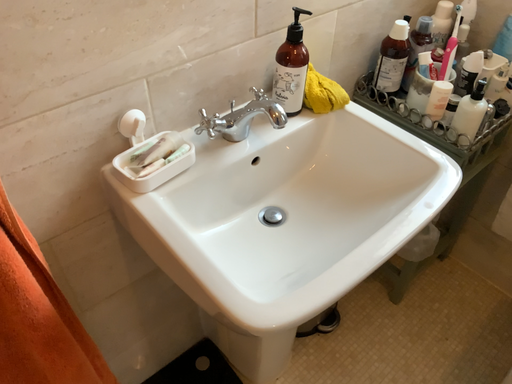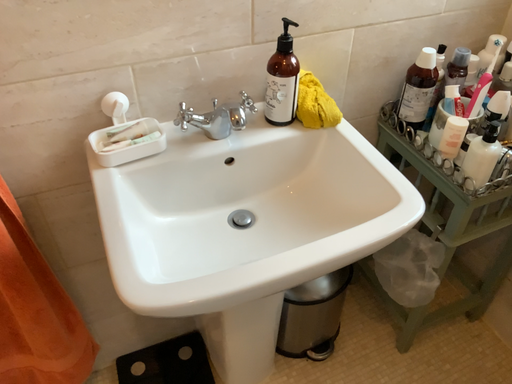
Question: Which way did the camera rotate in the video?

Choices:
 (A) rotated left
 (B) rotated right

Answer: (A)